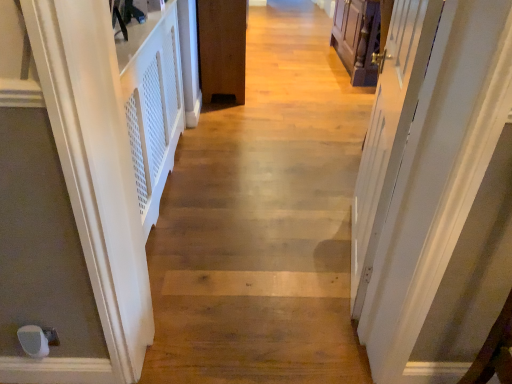
Find the location of a particular element. The image size is (512, 384). vacant location behind white glossy door at right is located at coordinates (315, 199).